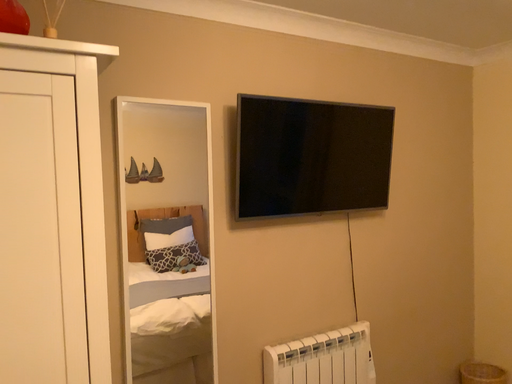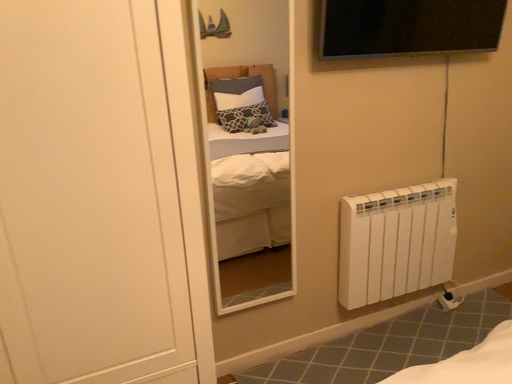
Question: Which way did the camera rotate in the video?

Choices:
 (A) rotated downward
 (B) rotated upward

Answer: (A)